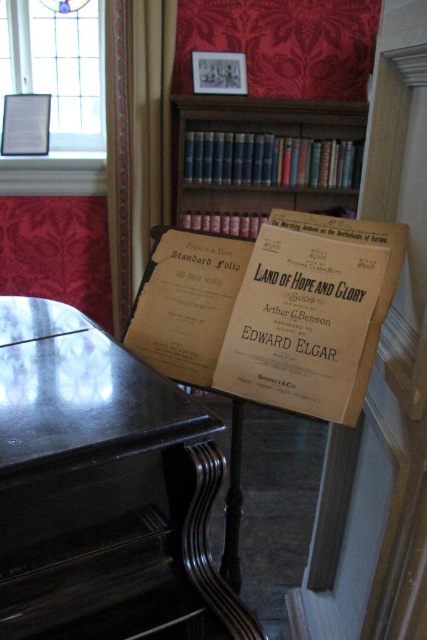
You are a musician planning to place a new sheet music binder on the desk between the black polished piano at center and the wooden bookcase at upper center. The binder is 30 cm wide. Can the desk accommodate the binder without it overlapping either object?

The black polished piano at center has a lesser width compared to wooden bookcase at upper center. Since the piano is narrower, there should be enough space on the desk between them to place the 30 cm wide binder without overlapping either object.

You are an interior designer planning to place a small decorative item between the two points in the room. Given that the item must be placed exactly halfway between point (17,342) and point (236,125), where would you position it?

The midpoint between point (17,342) and point (236,125) can be calculated by averaging their coordinates. The x coordinate is 0.536 and 0.198, so the average is 0.367. The y coordinate is 0.042 and 0.555, so the average is 0.2985. Therefore, the decorative item should be placed at the point 0.367, 0.2985.

You are standing in the room and want to move to the black polished piano at center. According to the coordinates provided, what are the exact coordinates where you should head to reach the piano?

The exact coordinates to reach the black polished piano at center are point [85,481].